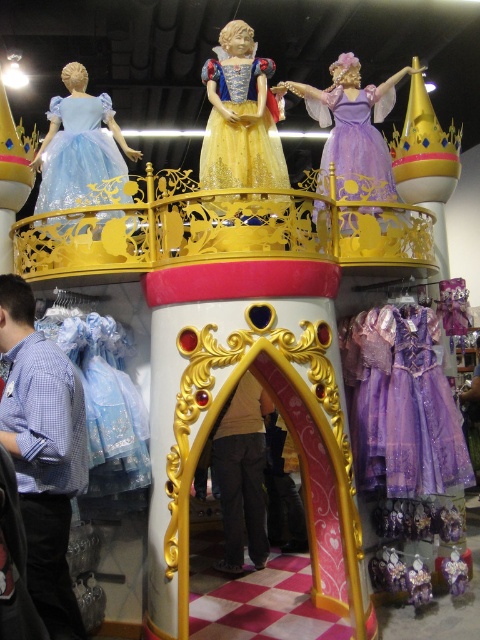
You are a customer in the store and want to know if the lavender satin dress at center and the purple satin dress at center can be placed side by side on a standard hanger without overlapping. The hanger is 1.5 inches wide. Can they fit?

The lavender satin dress at center and purple satin dress at center are 1.13 inches apart, so yes, they can be placed side by side on a 1.5 inch wide hanger without overlapping since the combined width is less than the hanger.

You are a customer in the store and want to know which dress is taller between the lavender satin dress at center and the purple satin dress at center. Can you tell me?

The lavender satin dress at center is taller than the purple satin dress at center.

You are standing in front of the castle display and want to take a photo. You notice two points marked on the display structure at coordinates point (313, 216) and point (365, 168). Which point should you focus on first if you want to capture the closest part of the display to your camera?

Point (313, 216) is closer to the camera than point (365, 168), so you should focus on point (313, 216) first to capture the closest part of the display.